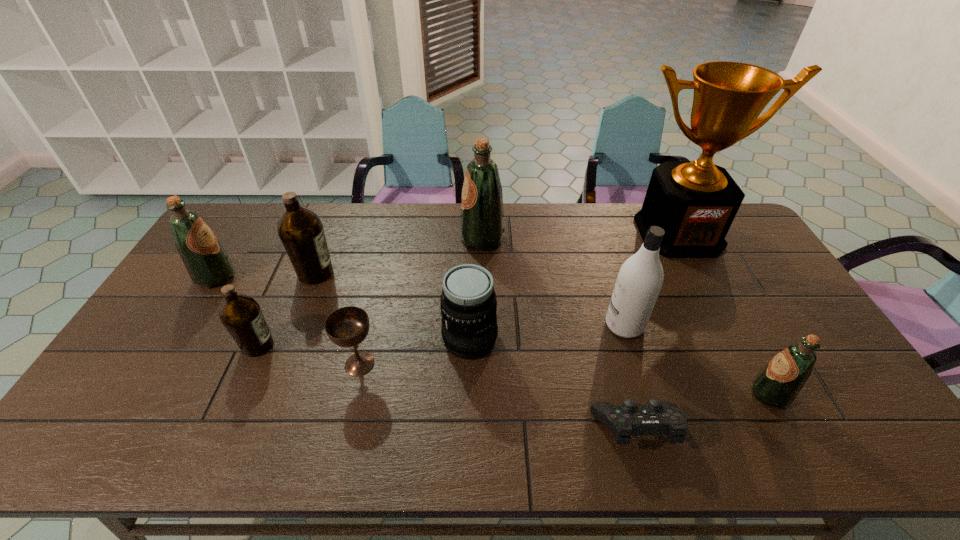
The width and height of the screenshot is (960, 540). In order to click on free location located 0.080m on the front-facing side of the shampoo in this screenshot , I will do `click(577, 325)`.

Find the location of a particular element. The width and height of the screenshot is (960, 540). free space located 0.140m on the front-facing side of the shampoo is located at coordinates (557, 325).

You are a GUI agent. You are given a task and a screenshot of the screen. Output one action in this format:
    pyautogui.click(x=<x>, y=<y>)
    Task: Click on the vacant space located on the front-facing side of the shampoo
    The width and height of the screenshot is (960, 540).
    Given the screenshot: What is the action you would take?
    pyautogui.click(x=512, y=325)

I want to click on blank space located 0.400m on the front-facing side of the second biggest green olive oil, so (x=359, y=276).

This screenshot has width=960, height=540. Find the location of `vacant region located on the label of the bigger brown olive oil`. vacant region located on the label of the bigger brown olive oil is located at coordinates (458, 273).

Locate an element on the screen. vacant region located 0.210m on the right of the telephoto lens is located at coordinates (572, 339).

At what (x,y) coordinates should I click in order to perform the action: click on vacant space located on the front-facing side of the nearest olive oil. Please return your answer as a coordinate pair (x, y). The height and width of the screenshot is (540, 960). Looking at the image, I should click on (640, 394).

This screenshot has width=960, height=540. I want to click on blank space located on the front-facing side of the nearest olive oil, so click(592, 394).

What are the coordinates of `vacant space located on the front-facing side of the nearest olive oil` in the screenshot? It's located at (620, 394).

Locate an element on the screen. free point located on the label of the nearer brown olive oil is located at coordinates (390, 345).